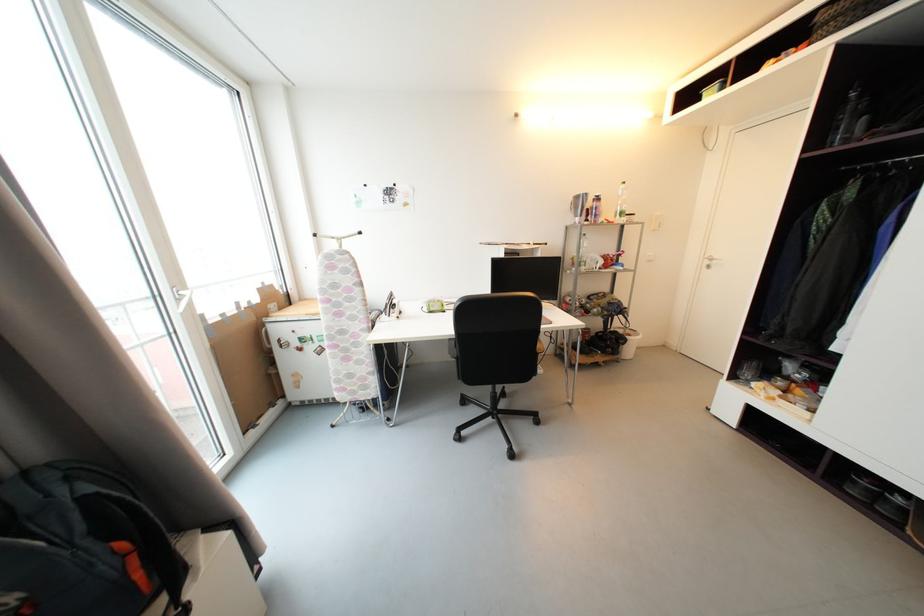
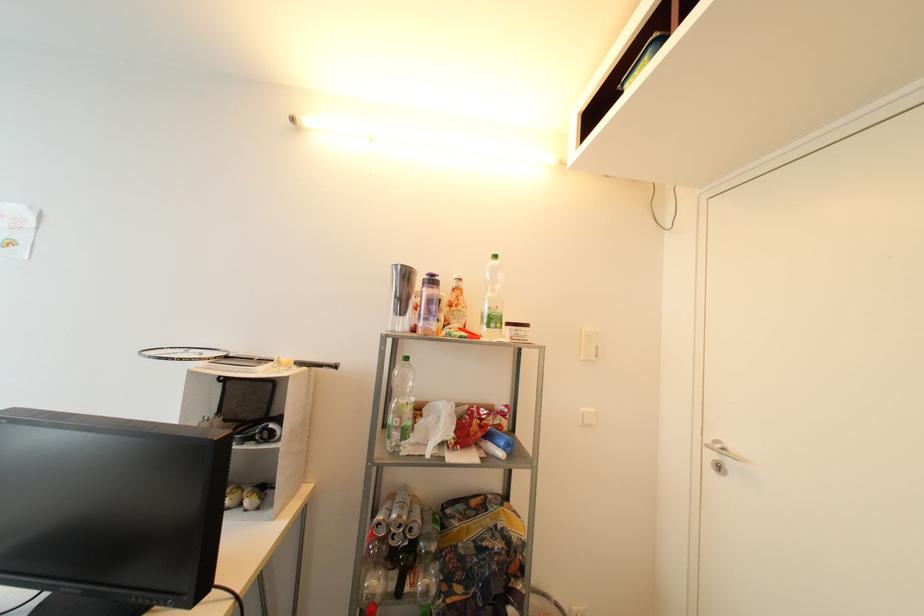
Find the pixel in the second image that matches (x=602, y=201) in the first image.

(438, 283)